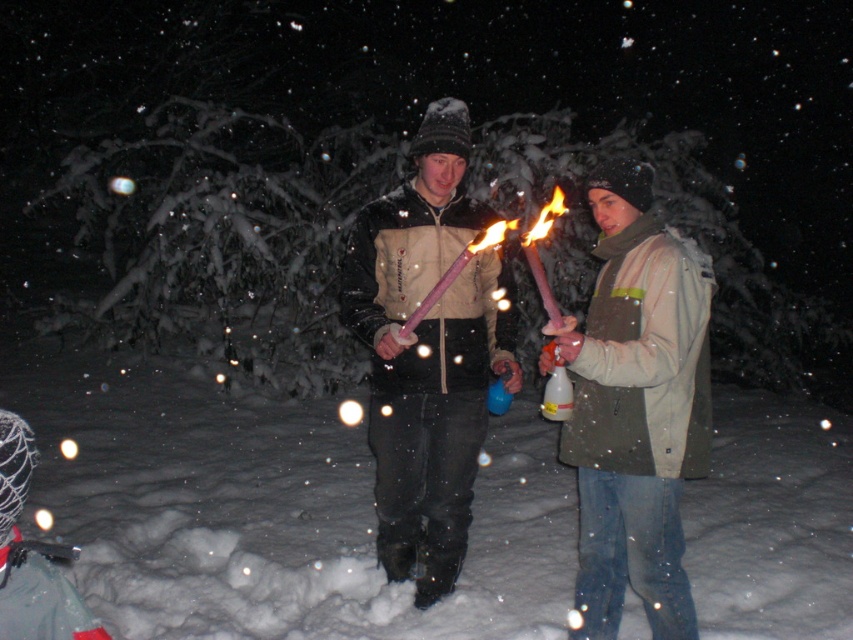
Which of these two, matte pink torch at center or khaki fabric jacket at center, stands taller?

With more height is khaki fabric jacket at center.

Is point (433, 384) more distant than point (624, 576)?

Yes, point (433, 384) is farther from viewer.

Is point (546, 360) behind point (647, 588)?

Yes, point (546, 360) is behind point (647, 588).

Image resolution: width=853 pixels, height=640 pixels. In order to click on matte pink torch at center in this screenshot , I will do (x=636, y=408).

In the scene shown: Who is taller, matte pink torch at center or matte beige vest at center?

Standing taller between the two is matte beige vest at center.

Which is in front, point (657, 625) or point (434, 131)?

Point (657, 625) is in front.

Does point (625, 396) come farther from viewer compared to point (393, 284)?

No.

At what (x,y) coordinates should I click in order to perform the action: click on matte pink torch at center. Please return your answer as a coordinate pair (x, y). The width and height of the screenshot is (853, 640). Looking at the image, I should click on (636, 408).

Does khaki fabric jacket at center appear under matte beige vest at center?

Correct, khaki fabric jacket at center is located below matte beige vest at center.

Who is taller, khaki fabric jacket at center or matte beige vest at center?

matte beige vest at center is taller.

Who is more forward, (x=596, y=280) or (x=389, y=240)?

Point (x=596, y=280) is in front.

The height and width of the screenshot is (640, 853). I want to click on khaki fabric jacket at center, so click(635, 406).